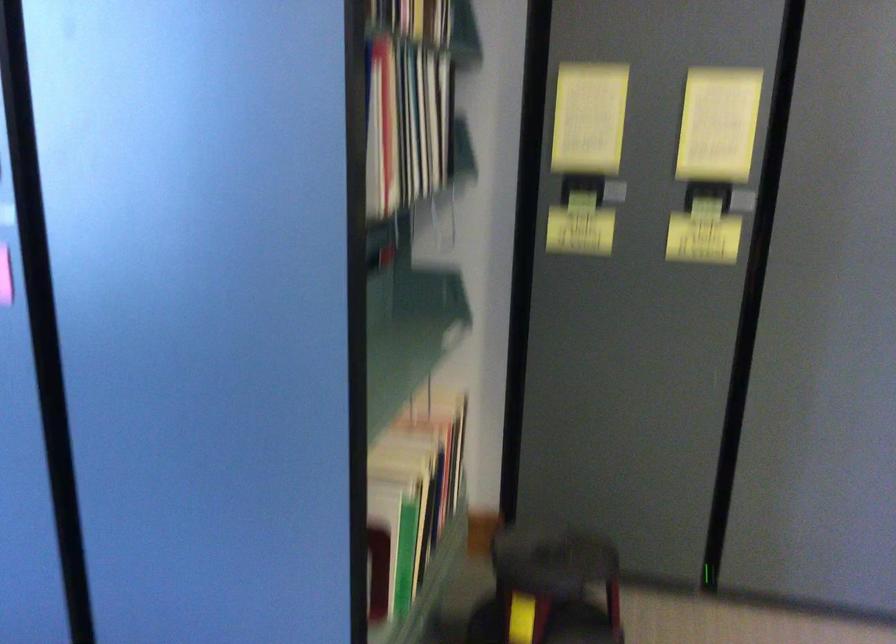
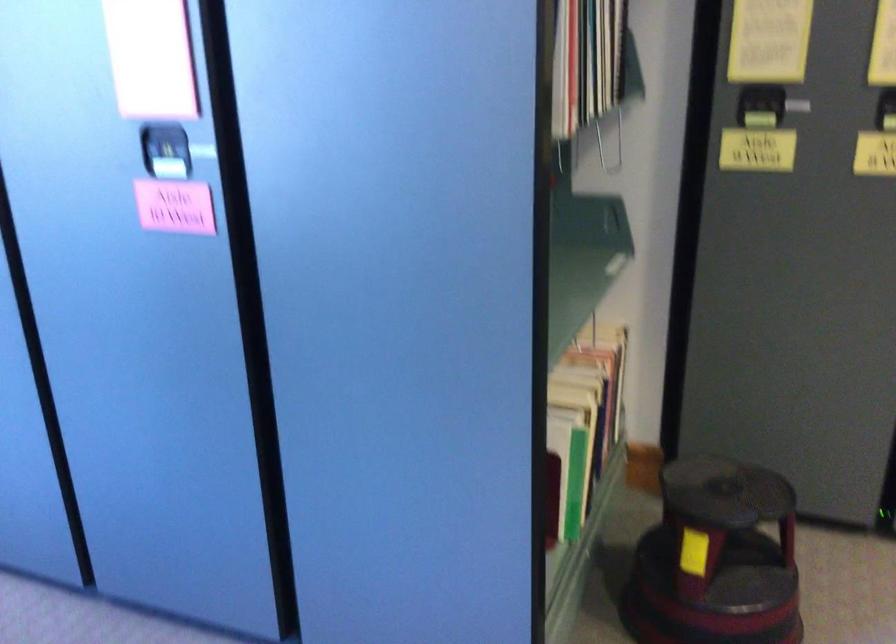
Question: How did the camera likely rotate?

Choices:
 (A) Left
 (B) Right
 (C) Up
 (D) Down

Answer: (A)